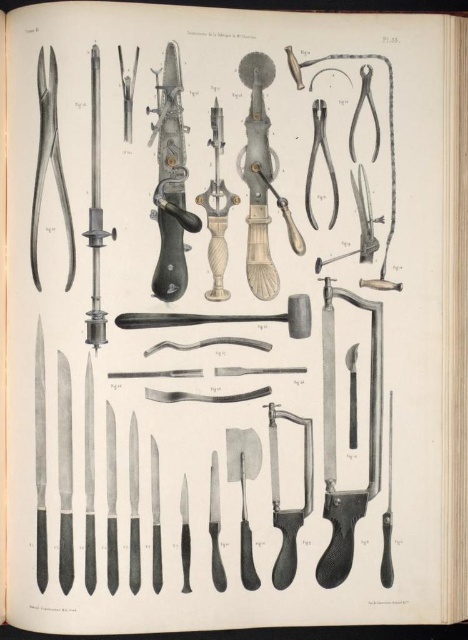
Question: Does matte silver razor at upper right have a larger size compared to matte black scalpel at upper left?

Choices:
 (A) no
 (B) yes

Answer: (B)

Question: Among these objects, which one is nearest to the camera?

Choices:
 (A) matte silver razor at upper right
 (B) matte metal razor at center
 (C) black plastic razor at center
 (D) matte black razor at center

Answer: (C)

Question: Which of the following is the farthest from the observer?

Choices:
 (A) click(271, 467)
 (B) click(52, 157)
 (C) click(365, 230)
 (D) click(212, 188)

Answer: (C)

Question: Does matte silver razor at left have a smaller size compared to matte metal razor at center?

Choices:
 (A) yes
 (B) no

Answer: (B)

Question: Which is farther from the black plastic razor at center?

Choices:
 (A) matte black scalpel at upper left
 (B) polished silver razor at center

Answer: (A)

Question: Does black plastic razor at center appear on the right side of matte black razor at center?

Choices:
 (A) yes
 (B) no

Answer: (A)